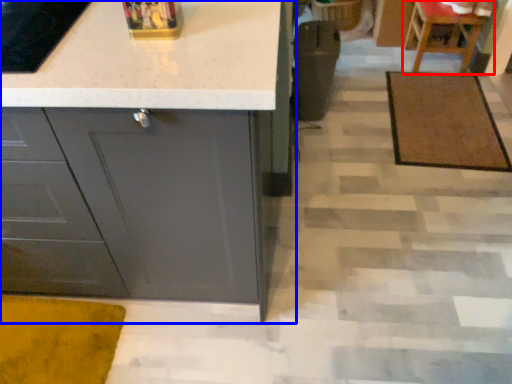
Question: Among these objects, which one is nearest to the camera, chair (highlighted by a red box) or cabinetry (highlighted by a blue box)?

Choices:
 (A) chair
 (B) cabinetry

Answer: (B)